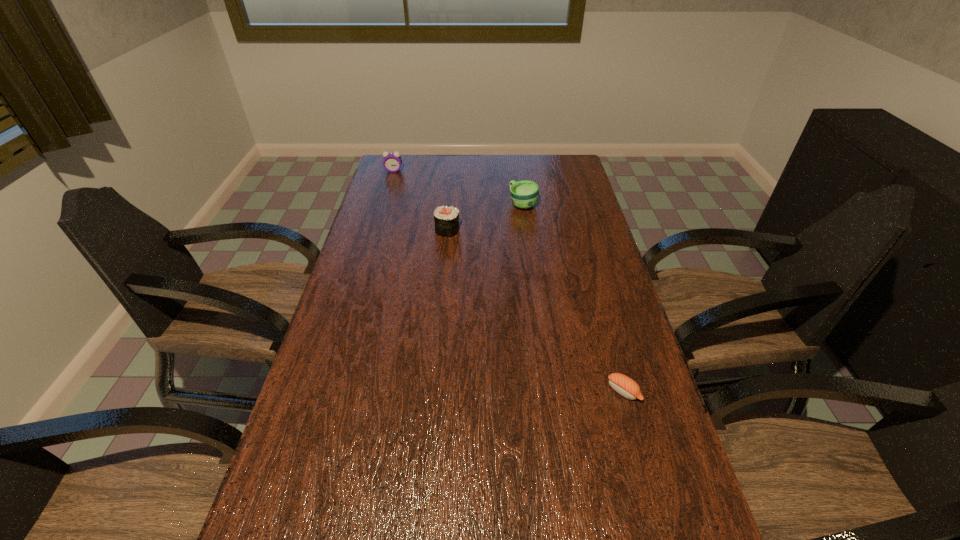
The image size is (960, 540). What are the coordinates of `the leftmost object` in the screenshot? It's located at (392, 162).

Identify the location of alarm clock. This screenshot has height=540, width=960. (392, 162).

Locate an element on the screen. the farther sushi is located at coordinates (446, 219).

Where is `the left sushi`? This screenshot has height=540, width=960. the left sushi is located at coordinates (446, 219).

Identify the location of the second farthest object. Image resolution: width=960 pixels, height=540 pixels. (524, 194).

The width and height of the screenshot is (960, 540). I want to click on the third object from left to right, so click(x=524, y=194).

This screenshot has width=960, height=540. In order to click on the shortest object in this screenshot , I will do `click(622, 384)`.

Where is `the rightmost object`? This screenshot has height=540, width=960. the rightmost object is located at coordinates (622, 384).

Where is `blank space located 0.310m on the face of the leftmost object`? The height and width of the screenshot is (540, 960). blank space located 0.310m on the face of the leftmost object is located at coordinates (380, 215).

Locate an element on the screen. The image size is (960, 540). free space located on the back of the taller sushi is located at coordinates (450, 203).